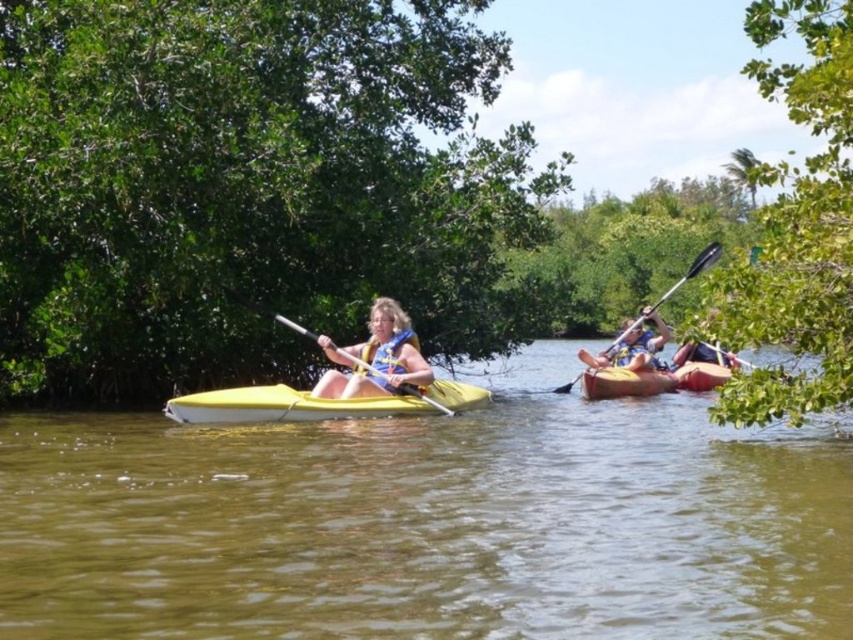
You are a safety inspector checking the kayaking setup. You notice the yellow life vest at center and the yellow plastic kayak at right. According to safety regulations, the life vest must be accessible and not stored under any part of the kayak. Is the current arrangement compliant with safety standards?

The yellow life vest at center is positioned under yellow plastic kayak at right, which violates safety regulations as it is not accessible. The life vest should be easily reachable and not stored underneath the kayak.

You are planning to take a kayak from the image for a short trip. The kayaks available are the yellow plastic kayak at center and the yellow matte kayak at center. Which kayak is closer to you?

The yellow plastic kayak at center is closer to you because it is positioned under the yellow matte kayak at center, indicating it is in front.

You are planning to wear the yellow life vest at center while sitting in the yellow plastic kayak at right. Considering their sizes, will the life vest fit comfortably over your clothing?

The yellow life vest at center is thinner than the yellow plastic kayak at right, so the life vest should fit comfortably over your clothing since it is narrower in width compared to the kayak.